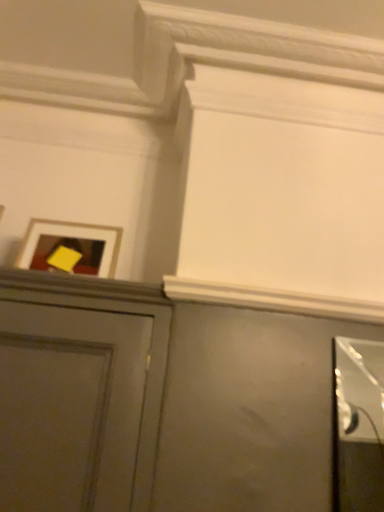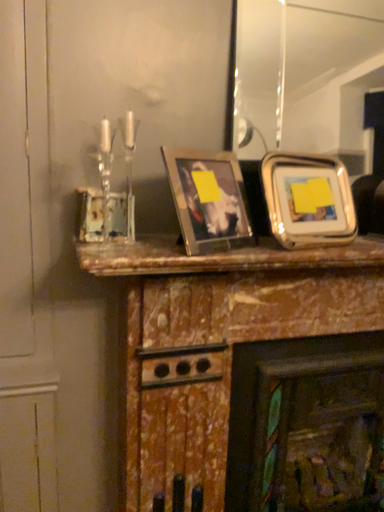
Question: Which way did the camera rotate in the video?

Choices:
 (A) rotated right
 (B) rotated left

Answer: (A)